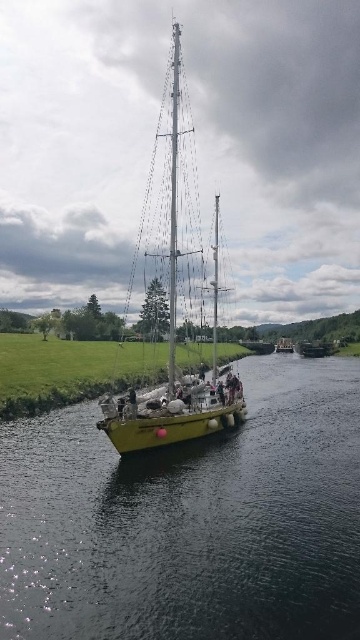
Question: Which of these objects is positioned farthest from the metallic silver mast at center?

Choices:
 (A) smooth yellow boat at center
 (B) yellow matte sailboat at center

Answer: (B)

Question: Is smooth yellow boat at center closer to camera compared to yellow matte sailboat at center?

Choices:
 (A) no
 (B) yes

Answer: (B)

Question: Among these objects, which one is farthest from the camera?

Choices:
 (A) yellow matte sailboat at center
 (B) metallic silver mast at center

Answer: (B)

Question: Which of the following is the closest to the observer?

Choices:
 (A) yellow matte sailboat at center
 (B) smooth yellow boat at center
 (C) metallic silver mast at center

Answer: (B)

Question: Is smooth yellow boat at center above metallic silver mast at center?

Choices:
 (A) yes
 (B) no

Answer: (B)

Question: Is yellow matte sailboat at center closer to camera compared to metallic silver mast at center?

Choices:
 (A) yes
 (B) no

Answer: (A)